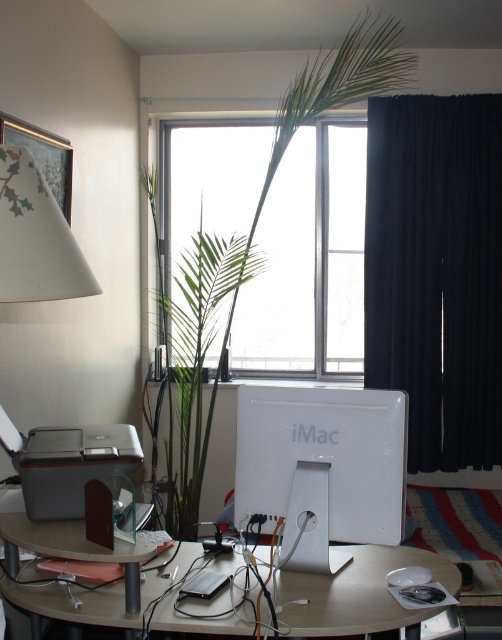
Question: Does dark blue fabric curtain at right appear on the right side of white glossy imac at center?

Choices:
 (A) yes
 (B) no

Answer: (A)

Question: Which point is closer to the camera?

Choices:
 (A) (333, 484)
 (B) (189, 349)
 (C) (240, 333)

Answer: (A)

Question: Which of the following is the closest to the observer?

Choices:
 (A) dark blue fabric curtain at right
 (B) wooden desk at lower center
 (C) white glossy imac at center
 (D) transparent glass window at center

Answer: (B)

Question: Considering the real-world distances, which object is closest to the white glossy imac at center?

Choices:
 (A) transparent glass window at center
 (B) green leafy plant at center

Answer: (B)

Question: From the image, what is the correct spatial relationship of transparent glass window at center in relation to white glossy imac at center?

Choices:
 (A) below
 (B) above

Answer: (B)

Question: Can you confirm if transparent glass window at center is wider than wooden desk at lower center?

Choices:
 (A) no
 (B) yes

Answer: (A)